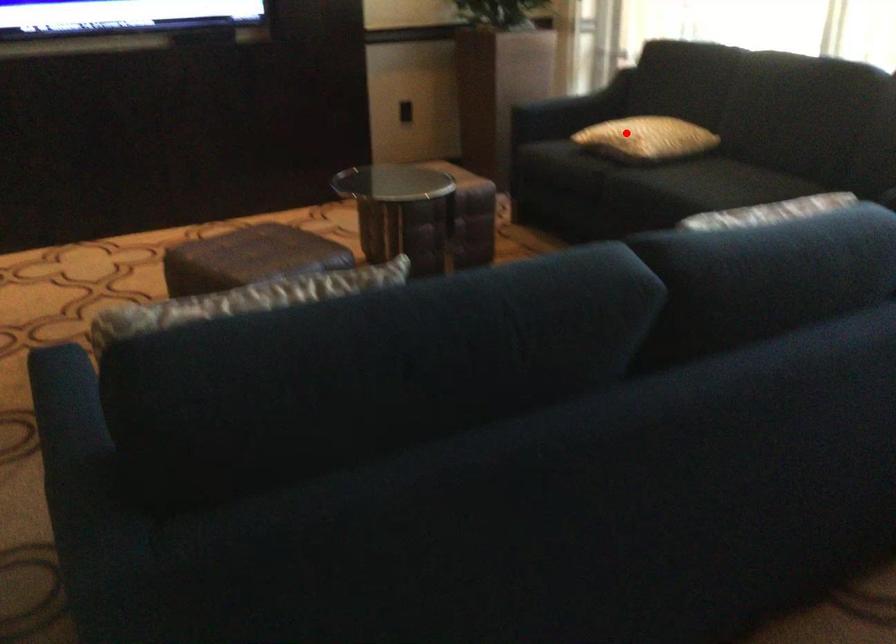
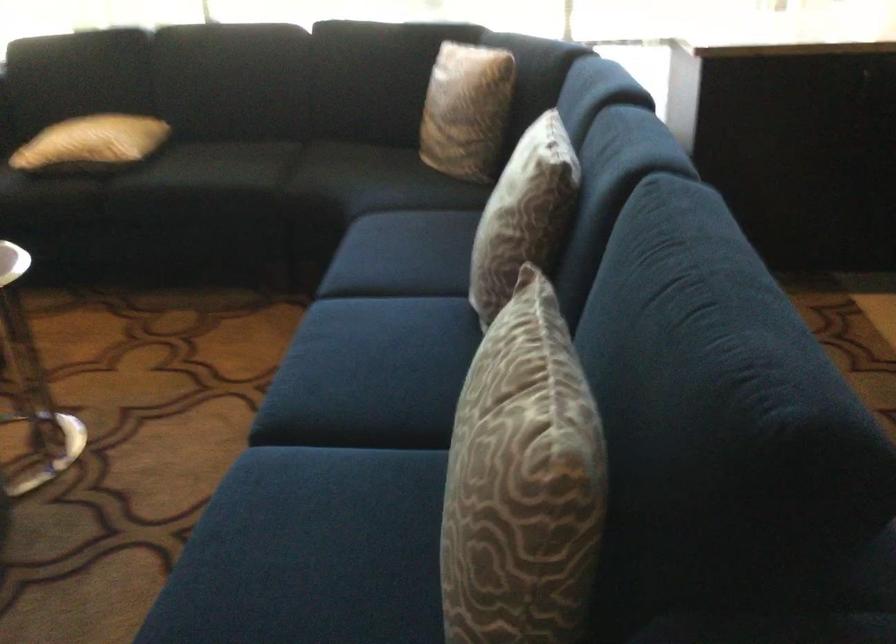
Where in the second image is the point corresponding to the highlighted location from the first image?

(91, 142)